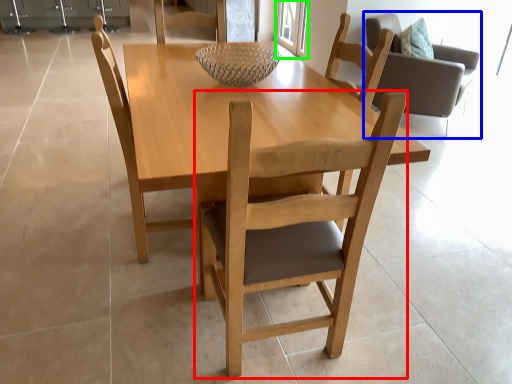
Question: Estimate the real-world distances between objects in this image. Which object is closer to chair (highlighted by a red box), chair (highlighted by a blue box) or glass door (highlighted by a green box)?

Choices:
 (A) chair
 (B) glass door

Answer: (A)